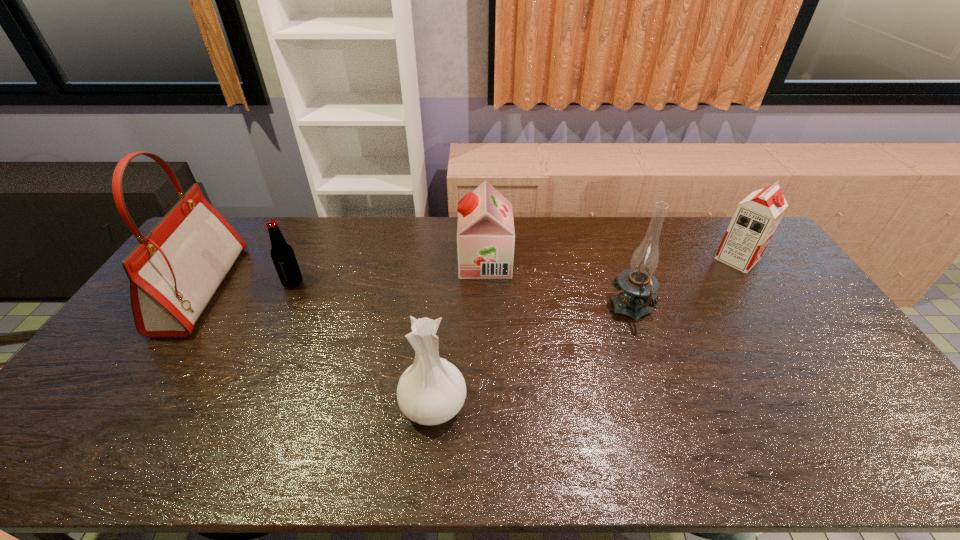
Locate an element on the screen. The width and height of the screenshot is (960, 540). free spot between the second tallest object and the tallest object is located at coordinates (417, 299).

Locate an element on the screen. vacant space that's between the beer bottle and the left soya milk is located at coordinates (389, 272).

The image size is (960, 540). I want to click on empty space between the second tallest object and the rightmost object, so click(x=684, y=284).

Locate an element on the screen. The height and width of the screenshot is (540, 960). free area in between the handbag and the left soya milk is located at coordinates (344, 275).

You are a GUI agent. You are given a task and a screenshot of the screen. Output one action in this format:
    pyautogui.click(x=<x>, y=<y>)
    Task: Click on the free space between the left soya milk and the rightmost object
    The height and width of the screenshot is (540, 960).
    Given the screenshot: What is the action you would take?
    pyautogui.click(x=612, y=260)

Image resolution: width=960 pixels, height=540 pixels. In order to click on vacant region between the beer bottle and the right soya milk in this screenshot , I will do `click(516, 271)`.

Locate an element on the screen. free point between the right soya milk and the second object from left to right is located at coordinates (516, 271).

Locate an element on the screen. This screenshot has height=540, width=960. vacant space that's between the right soya milk and the vase is located at coordinates (586, 331).

The image size is (960, 540). Find the location of `object that stands as the third closest to the beer bottle`. object that stands as the third closest to the beer bottle is located at coordinates (485, 232).

Identify the location of object that is the fifth closest to the left soya milk. Image resolution: width=960 pixels, height=540 pixels. (174, 272).